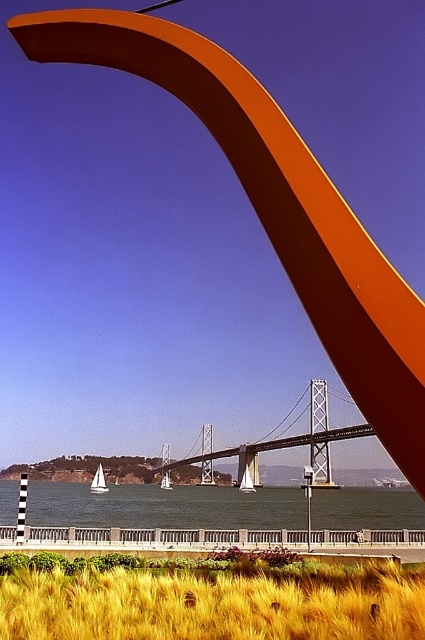
Is point (263, 572) positioned before point (252, 452)?

That is True.

From the picture: Which of these two, golden wheat field at lower center or metallic gray bridge at center, stands taller?

Standing taller between the two is metallic gray bridge at center.

Who is more distant from viewer, (408, 568) or (342, 433)?

The point (342, 433) is behind.

Identify the location of golden wheat field at lower center. This screenshot has width=425, height=640. (215, 602).

Is blue water at center positioned before metallic gray bridge at center?

Yes, it is in front of metallic gray bridge at center.

Is blue water at center wider than metallic gray bridge at center?

Yes.

Does point (371, 518) come in front of point (161, 481)?

Yes, point (371, 518) is in front of point (161, 481).

Locate an element on the screen. This screenshot has height=640, width=425. blue water at center is located at coordinates (163, 512).

Does golden wheat field at lower center lie behind blue water at center?

No.

Between golden wheat field at lower center and blue water at center, which one appears on the left side from the viewer's perspective?

Positioned to the left is blue water at center.

Between point (235, 582) and point (416, 518), which one is positioned in front?

Positioned in front is point (235, 582).

This screenshot has width=425, height=640. I want to click on golden wheat field at lower center, so click(215, 602).